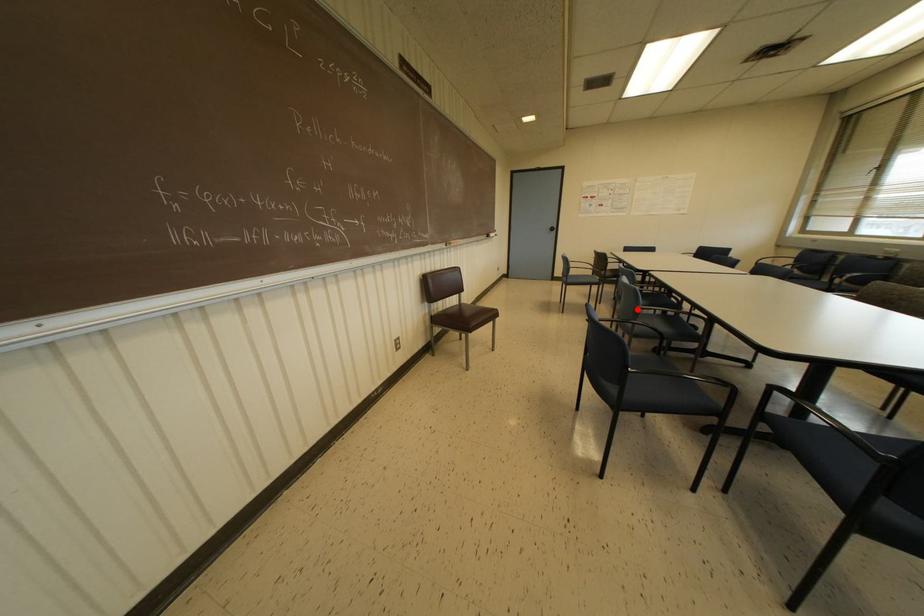
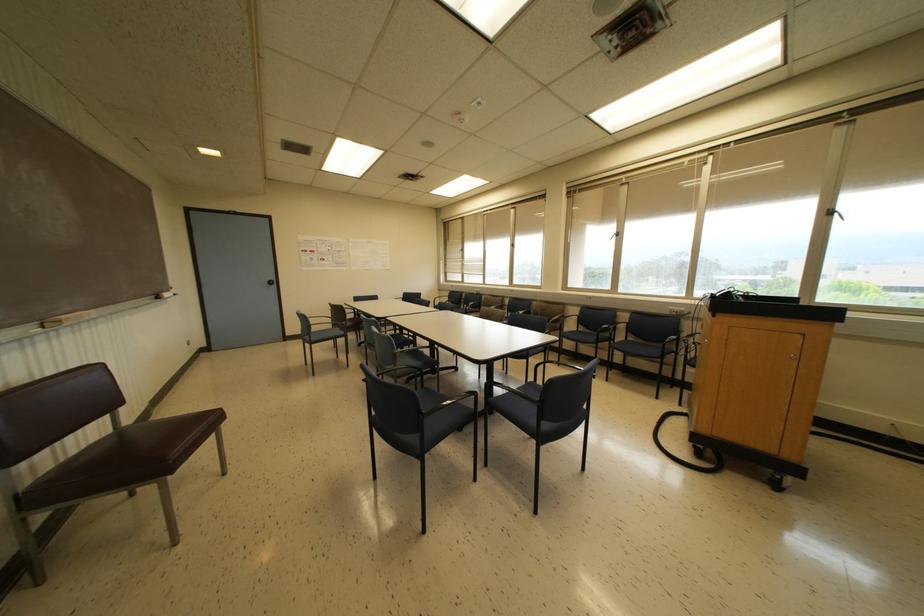
Question: A red point is marked in image1. In image2, is the corresponding 3D point closer to the camera or farther? Reply with the corresponding letter.

Choices:
 (A) The corresponding 3D point is closer.
 (B) The corresponding 3D point is farther.

Answer: (B)